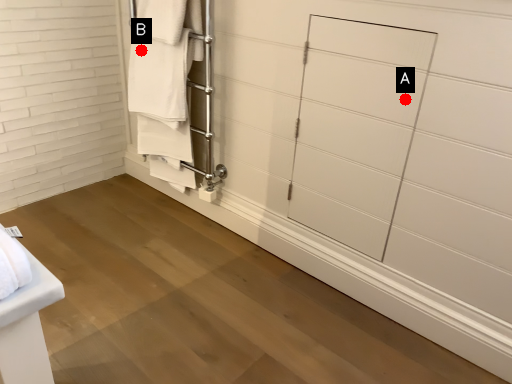
Question: Two points are circled on the image, labeled by A and B beside each circle. Among these points, which one is nearest to the camera?

Choices:
 (A) A is closer
 (B) B is closer

Answer: (A)